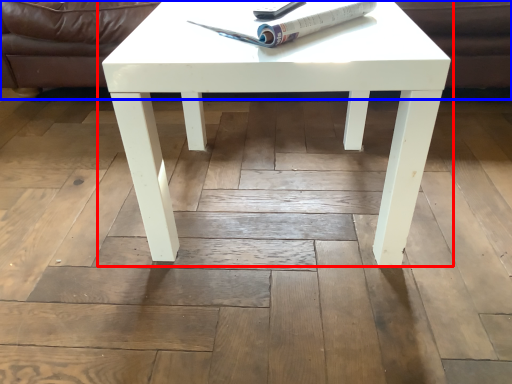
Question: Which object is closer to the camera taking this photo, coffee table (highlighted by a red box) or couch (highlighted by a blue box)?

Choices:
 (A) coffee table
 (B) couch

Answer: (A)